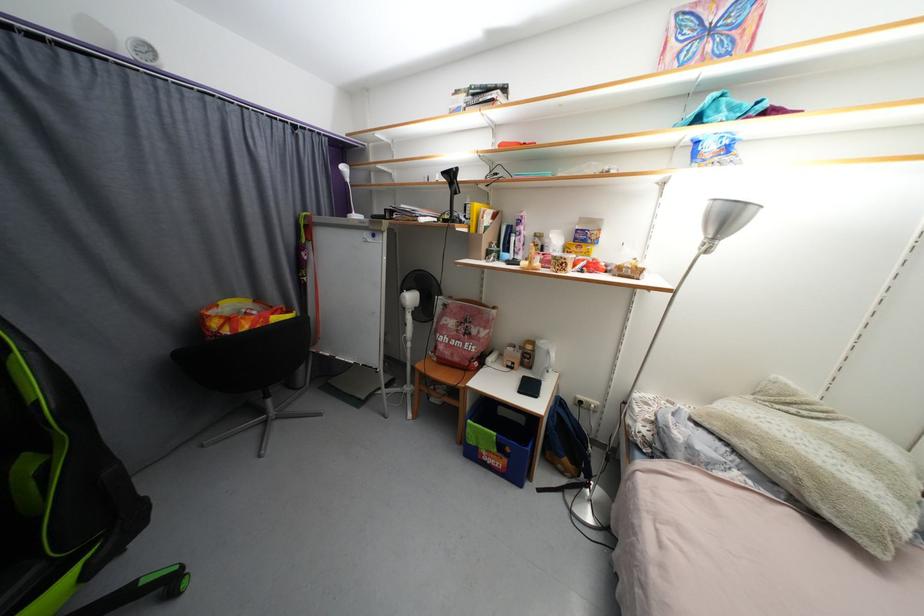
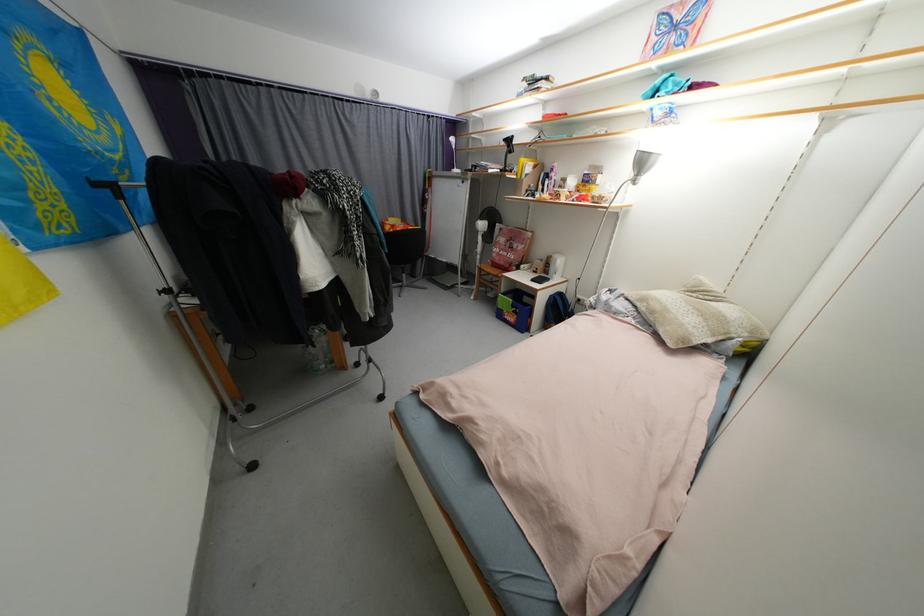
Where in the second image is the point corresponding to (x=511, y=463) from the first image?

(520, 318)